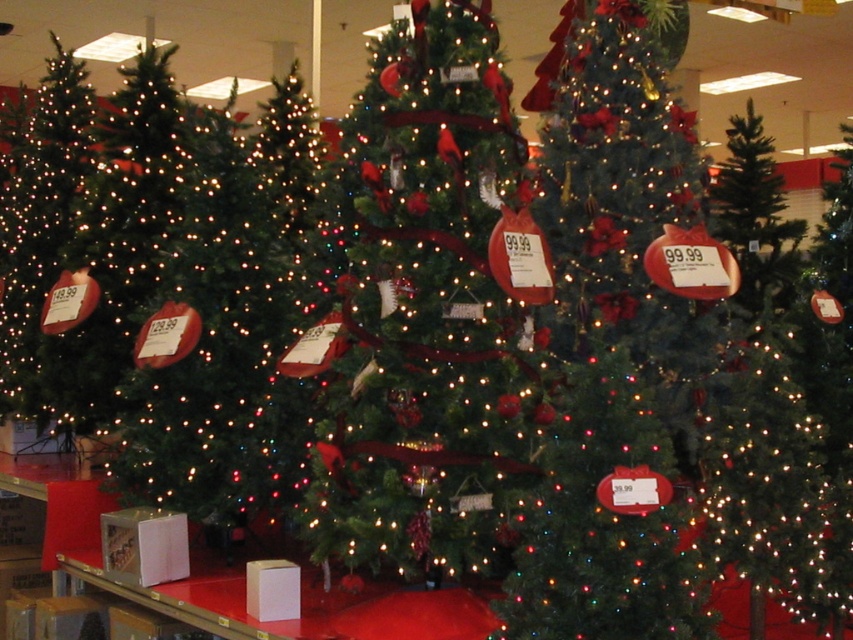
Is shiny green christmas tree at center behind green matte christmas tree at left?

No.

Which is in front, point (567, 168) or point (286, 486)?

Point (567, 168) is more forward.

Which is behind, point (608, 102) or point (299, 230)?

The point (299, 230) is behind.

The width and height of the screenshot is (853, 640). Find the location of `shiny green christmas tree at center`. shiny green christmas tree at center is located at coordinates (614, 344).

The width and height of the screenshot is (853, 640). What do you see at coordinates (424, 308) in the screenshot? I see `green matte christmas tree at center` at bounding box center [424, 308].

Does point (381, 467) lie behind point (556, 564)?

Yes.

This screenshot has width=853, height=640. In order to click on green matte christmas tree at center in this screenshot , I will do `click(424, 308)`.

Between green matte christmas tree at center and shiny green christmas tree at left, which one appears on the left side from the viewer's perspective?

Positioned to the left is shiny green christmas tree at left.

Is point (440, 218) less distant than point (91, 410)?

That is True.

You are a GUI agent. You are given a task and a screenshot of the screen. Output one action in this format:
    pyautogui.click(x=<x>, y=<y>)
    Task: Click on the green matte christmas tree at center
    The height and width of the screenshot is (640, 853).
    Given the screenshot: What is the action you would take?
    pyautogui.click(x=424, y=308)

Locate an element on the screen. green matte christmas tree at center is located at coordinates (424, 308).